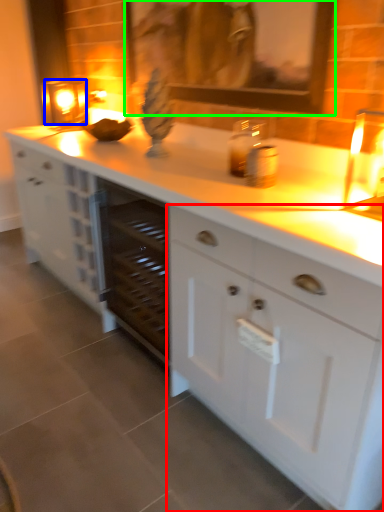
Question: Which object is positioned closest to cabinetry (highlighted by a red box)? Select from candle holder (highlighted by a blue box) and picture frame (highlighted by a green box).

Choices:
 (A) candle holder
 (B) picture frame

Answer: (B)